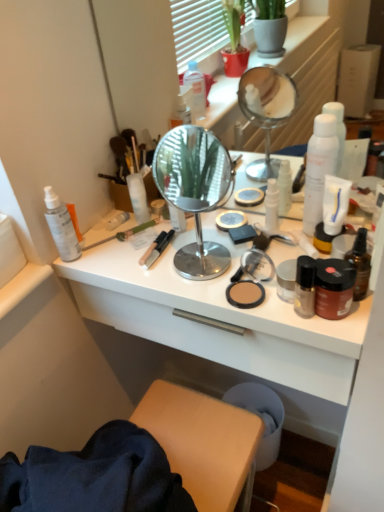
Find the location of a particular element. This screenshot has width=384, height=512. free space between polished chrome mirror at center and white matte bottle at center, the 5th toiletry viewed from the right is located at coordinates (170, 240).